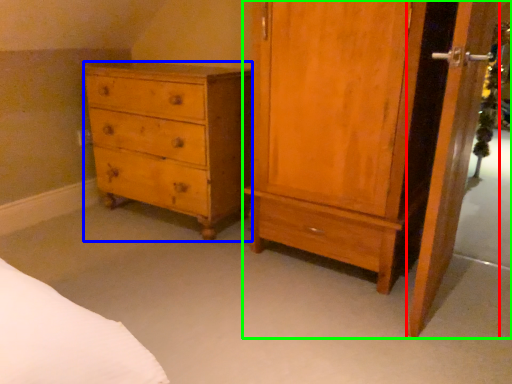
Question: Which object is the farthest from screen door (highlighted by a red box)? Choose among these: chest of drawers (highlighted by a blue box) or nightstand (highlighted by a green box).

Choices:
 (A) chest of drawers
 (B) nightstand

Answer: (A)